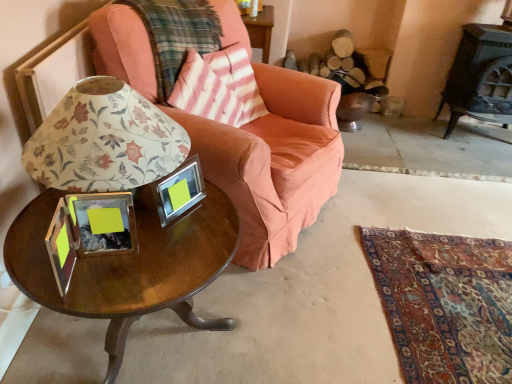
The image size is (512, 384). Describe the element at coordinates (104, 140) in the screenshot. I see `floral paper lampshade at center` at that location.

Identify the location of matte pink fabric chair at center. (274, 161).

Measure the distance between point (205, 158) and camera.

The distance of point (205, 158) from camera is 1.54 meters.

Locate an element on the screen. This screenshot has width=512, height=384. shiny brown wood coffee table at lower left is located at coordinates (129, 266).

Measure the distance between point (356, 80) and camera.

They are 9.26 feet apart.

The height and width of the screenshot is (384, 512). In order to click on floral paper lampshade at center in this screenshot , I will do `click(104, 140)`.

Based on the photo, is clear glass picture frame at center positioned with its back to shiny brown wood coffee table at lower left?

No, shiny brown wood coffee table at lower left is not at the back of clear glass picture frame at center.

Based on the photo, from the image's perspective, which one is positioned lower, clear glass picture frame at center or shiny brown wood coffee table at lower left?

shiny brown wood coffee table at lower left is shown below in the image.

Based on the photo, is clear glass picture frame at center positioned far away from shiny brown wood coffee table at lower left?

No, clear glass picture frame at center is not far from shiny brown wood coffee table at lower left.

From a real-world perspective, between shiny brown wood coffee table at lower left and matte pink fabric chair at center, who is vertically higher?

matte pink fabric chair at center is physically above.

Between point (117, 352) and point (234, 201), which one is positioned behind?

The point (234, 201) is more distant.

Considering the relative sizes of plaid fabric cushion at upper left and floral paper lampshade at center in the image provided, is plaid fabric cushion at upper left shorter than floral paper lampshade at center?

Incorrect, the height of plaid fabric cushion at upper left does not fall short of that of floral paper lampshade at center.

Considering the positions of objects plaid fabric cushion at upper left and floral paper lampshade at center in the image provided, who is in front, plaid fabric cushion at upper left or floral paper lampshade at center?

floral paper lampshade at center is more forward.

Considering the relative positions of plaid fabric cushion at upper left and floral paper lampshade at center in the image provided, is plaid fabric cushion at upper left to the left or to the right of floral paper lampshade at center?

plaid fabric cushion at upper left is to the right of floral paper lampshade at center.

Is floral paper lampshade at center located within plaid fabric cushion at upper left?

No, floral paper lampshade at center is located outside of plaid fabric cushion at upper left.

How different are the orientations of shiny brown wood coffee table at lower left and pink striped fabric pillow at upper center in degrees?

shiny brown wood coffee table at lower left and pink striped fabric pillow at upper center are facing 34.6 degrees away from each other.

Does shiny brown wood coffee table at lower left turn towards pink striped fabric pillow at upper center?

No, shiny brown wood coffee table at lower left does not turn towards pink striped fabric pillow at upper center.

From the image's perspective, which one is positioned higher, shiny brown wood coffee table at lower left or pink striped fabric pillow at upper center?

pink striped fabric pillow at upper center.

Is shiny brown wood coffee table at lower left not close to pink striped fabric pillow at upper center?

Actually, shiny brown wood coffee table at lower left and pink striped fabric pillow at upper center are a little close together.

Considering the sizes of objects shiny brown wood coffee table at lower left and plaid fabric cushion at upper left in the image provided, who is thinner, shiny brown wood coffee table at lower left or plaid fabric cushion at upper left?

Thinner between the two is plaid fabric cushion at upper left.

Is shiny brown wood coffee table at lower left oriented towards plaid fabric cushion at upper left?

No, shiny brown wood coffee table at lower left is not aimed at plaid fabric cushion at upper left.

Is shiny brown wood coffee table at lower left bigger than plaid fabric cushion at upper left?

Yes.

Is shiny brown wood coffee table at lower left inside or outside of plaid fabric cushion at upper left?

shiny brown wood coffee table at lower left is not inside plaid fabric cushion at upper left, it's outside.

Find the location of `throw pillow that is behind the clear glass picture frame at center`. throw pillow that is behind the clear glass picture frame at center is located at coordinates (219, 87).

Is pink striped fabric pillow at upper center smaller than clear glass picture frame at center?

Actually, pink striped fabric pillow at upper center might be larger than clear glass picture frame at center.

Does point (220, 121) lie in front of point (190, 203)?

No, (220, 121) is behind (190, 203).

How different are the orientations of pink striped fabric pillow at upper center and clear glass picture frame at center in degrees?

The angular difference between pink striped fabric pillow at upper center and clear glass picture frame at center is 2.73 degrees.

Considering the sizes of objects matte pink fabric chair at center and shiny brown wood coffee table at lower left in the image provided, who is wider, matte pink fabric chair at center or shiny brown wood coffee table at lower left?

matte pink fabric chair at center.

Which object is more forward, matte pink fabric chair at center or shiny brown wood coffee table at lower left?

shiny brown wood coffee table at lower left.

Between matte pink fabric chair at center and shiny brown wood coffee table at lower left, which one has larger size?

matte pink fabric chair at center.

Locate an element on the screen. This screenshot has height=384, width=512. chair behind the shiny brown wood coffee table at lower left is located at coordinates (274, 161).

You are a GUI agent. You are given a task and a screenshot of the screen. Output one action in this format:
    pyautogui.click(x=<x>, y=<y>)
    Task: Click on the picture frame above the shiny brown wood coffee table at lower left (from a real-world perspective)
    The height and width of the screenshot is (384, 512).
    Given the screenshot: What is the action you would take?
    pyautogui.click(x=179, y=190)

Locate an element on the screen. chair that appears behind the shiny brown wood coffee table at lower left is located at coordinates (274, 161).

Which object lies further to the anchor point pink striped fabric pillow at upper center, shiny brown wood coffee table at lower left or plaid fabric cushion at upper left?

The object further to pink striped fabric pillow at upper center is shiny brown wood coffee table at lower left.

Estimate the real-world distances between objects in this image. Which object is further from pink striped fabric pillow at upper center, matte pink fabric chair at center or velvet orange swivel chair at center?

The object further to pink striped fabric pillow at upper center is velvet orange swivel chair at center.

Based on their spatial positions, is velvet orange swivel chair at center or matte pink fabric chair at center closer to clear glass picture frame at center?

matte pink fabric chair at center is positioned closer to the anchor clear glass picture frame at center.

Looking at the image, which one is located further to matte pink fabric chair at center, pink striped fabric pillow at upper center or clear glass picture frame at center?

clear glass picture frame at center is positioned further to the anchor matte pink fabric chair at center.

Estimate the real-world distances between objects in this image. Which object is further from clear glass picture frame at center, pink striped fabric pillow at upper center or floral paper lampshade at center?

The object further to clear glass picture frame at center is pink striped fabric pillow at upper center.

Which object lies nearer to the anchor point velvet orange swivel chair at center, floral paper lampshade at center or pink striped fabric pillow at upper center?

Based on the image, pink striped fabric pillow at upper center appears to be nearer to velvet orange swivel chair at center.

Which object lies further to the anchor point floral paper lampshade at center, clear glass picture frame at center or velvet orange swivel chair at center?

velvet orange swivel chair at center lies further to floral paper lampshade at center than the other object.

Based on their spatial positions, is matte pink fabric chair at center or pink striped fabric pillow at upper center further from shiny brown wood coffee table at lower left?

pink striped fabric pillow at upper center lies further to shiny brown wood coffee table at lower left than the other object.

Where is `plaid located between matte pink fabric chair at center and pink striped fabric pillow at upper center in the depth direction`? This screenshot has height=384, width=512. plaid located between matte pink fabric chair at center and pink striped fabric pillow at upper center in the depth direction is located at coordinates point(176,35).

Locate an element on the screen. chair between floral paper lampshade at center and pink striped fabric pillow at upper center along the z-axis is located at coordinates (274, 161).

Find the location of a particular element. This screenshot has height=384, width=512. chair located between clear glass picture frame at center and pink striped fabric pillow at upper center in the depth direction is located at coordinates (274, 161).

Locate an element on the screen. The image size is (512, 384). chair between clear glass picture frame at center and velvet orange swivel chair at center in the front-back direction is located at coordinates (274, 161).